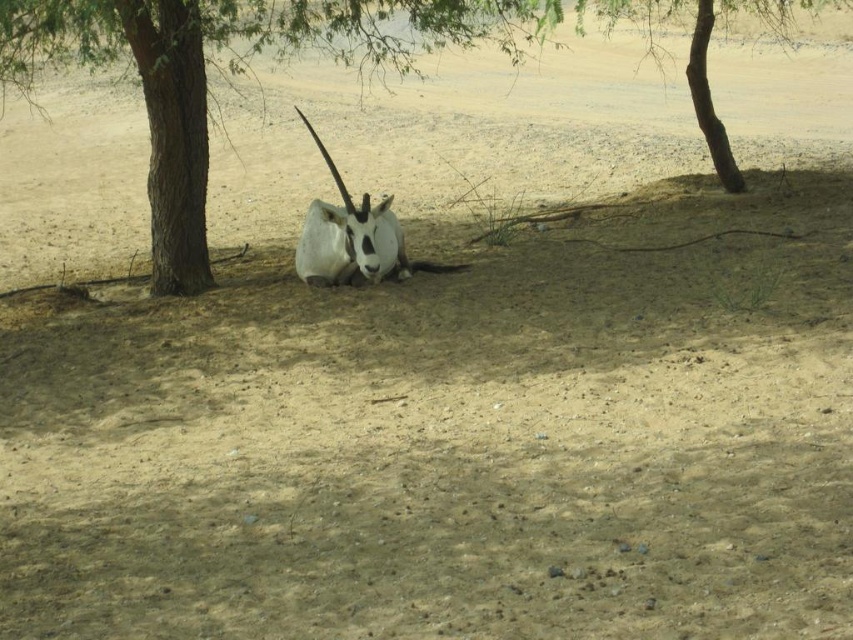
Measure the distance between brown rough tree at left and brown rough tree at upper center.

brown rough tree at left is 3.47 meters away from brown rough tree at upper center.

Identify the location of brown rough tree at left. (234, 72).

Measure the distance between point [164,13] and camera.

Point [164,13] and camera are 8.19 meters apart from each other.

This screenshot has width=853, height=640. Find the location of `brown rough tree at left`. brown rough tree at left is located at coordinates (234, 72).

Is point (723, 140) positioned after point (297, 243)?

Yes.

Can you confirm if brown rough tree at upper center is positioned below white matte antelope at center?

Incorrect, brown rough tree at upper center is not positioned below white matte antelope at center.

Locate an element on the screen. brown rough tree at upper center is located at coordinates (701, 51).

Which is behind, point (158, 262) or point (366, 237)?

The point (158, 262) is behind.

Which is below, brown rough tree at left or white matte antelope at center?

white matte antelope at center is below.

Who is more forward, [485,28] or [334,180]?

Point [334,180] is in front.

The image size is (853, 640). Identify the location of brown rough tree at left. (234, 72).